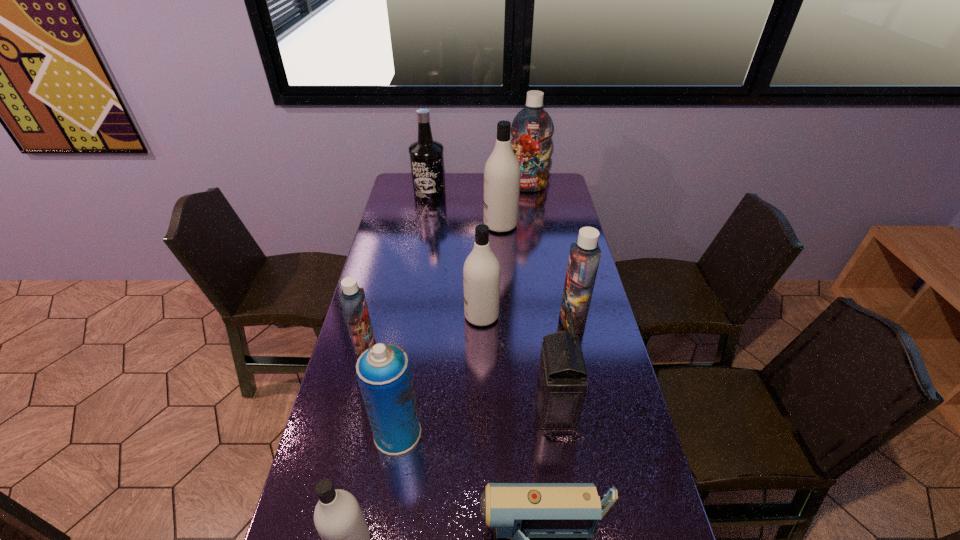
Identify which white shampoo is the closest to the black liquor. Please provide its 2D coordinates. Your answer should be formatted as a tuple, i.e. [(x, y)], where the tuple contains the x and y coordinates of a point satisfying the conditions above.

[(502, 172)]

Identify which blue shampoo is the third nearest to the second farthest shampoo. Please provide its 2D coordinates. Your answer should be formatted as a tuple, i.e. [(x, y)], where the tuple contains the x and y coordinates of a point satisfying the conditions above.

[(353, 301)]

You are a GUI agent. You are given a task and a screenshot of the screen. Output one action in this format:
    pyautogui.click(x=<x>, y=<y>)
    Task: Click on the blue shampoo identified as the closest to the farthest shampoo
    This screenshot has width=960, height=540.
    Given the screenshot: What is the action you would take?
    pyautogui.click(x=584, y=257)

Identify the location of vacant position in the image that satisfies the following two spatial constraints: 1. on the front label of the biggest blue shampoo; 2. on the front-facing side of the second farthest shampoo. (534, 225).

This screenshot has height=540, width=960. I want to click on free space that satisfies the following two spatial constraints: 1. on the front label of the biggest blue shampoo; 2. on the front-facing side of the farthest white shampoo, so click(x=534, y=225).